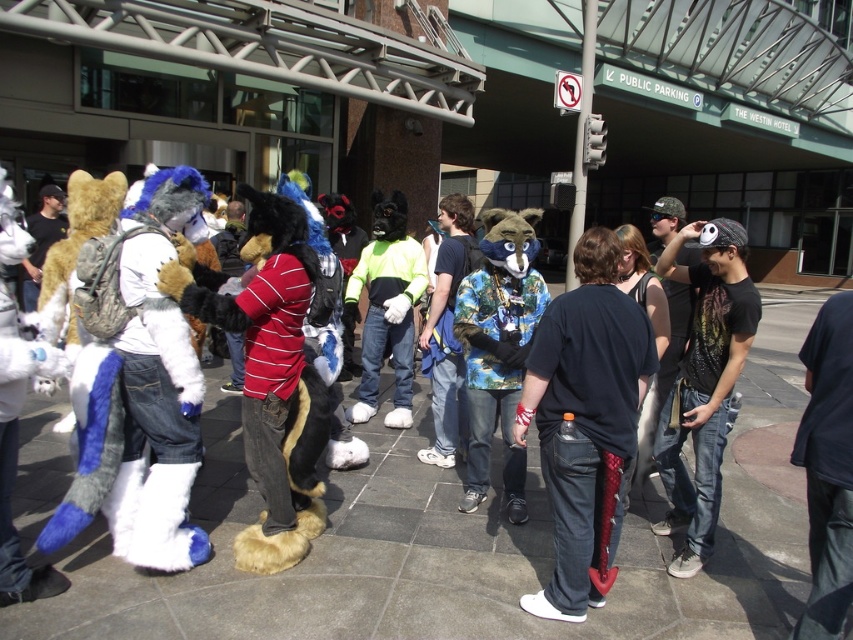
In the scene shown: Who is more forward, (633, 301) or (683, 573)?

Point (633, 301) is more forward.

Can you confirm if black matte shirt at center is taller than black matte t-shirt at center?

No.

Where is `black matte shirt at center`? The height and width of the screenshot is (640, 853). black matte shirt at center is located at coordinates (585, 420).

Which is above, dark blue hoodie at center or neon green and black costume at center?

neon green and black costume at center is higher up.

Measure the distance between dark blue hoodie at center and neon green and black costume at center.

They are 3.78 meters apart.

Is point (825, 369) behind point (386, 416)?

That is False.

The height and width of the screenshot is (640, 853). What are the coordinates of `dark blue hoodie at center` in the screenshot? It's located at (827, 467).

Does fluffy blue and white costume at center appear on the right side of neon green and black costume at center?

Correct, you'll find fluffy blue and white costume at center to the right of neon green and black costume at center.

Which is more to the left, fluffy blue and white costume at center or neon green and black costume at center?

neon green and black costume at center is more to the left.

Measure the distance between point (529, 321) and camera.

Point (529, 321) and camera are 4.31 meters apart from each other.

You are a GUI agent. You are given a task and a screenshot of the screen. Output one action in this format:
    pyautogui.click(x=<x>, y=<y>)
    Task: Click on the fluffy blue and white costume at center
    This screenshot has height=640, width=853.
    Given the screenshot: What is the action you would take?
    pyautogui.click(x=498, y=348)